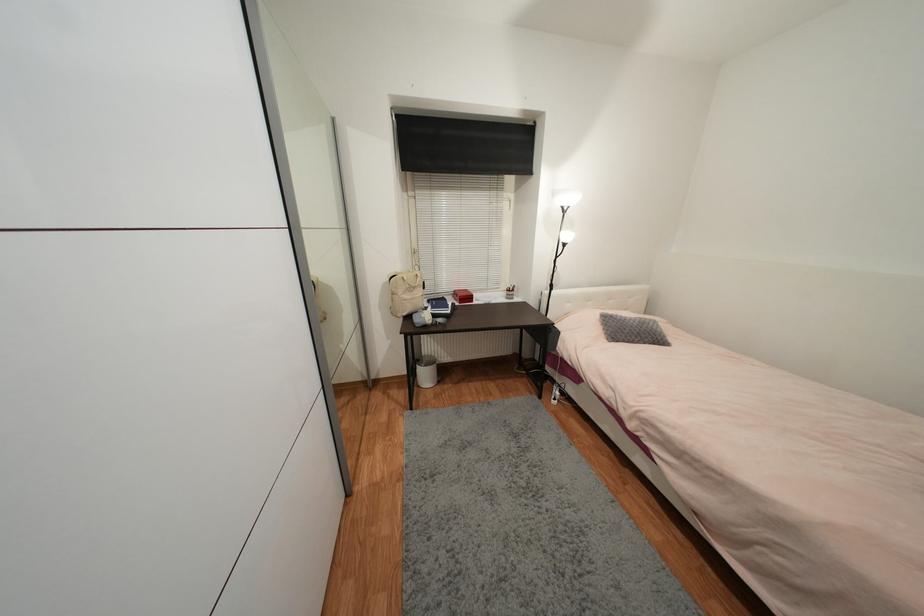
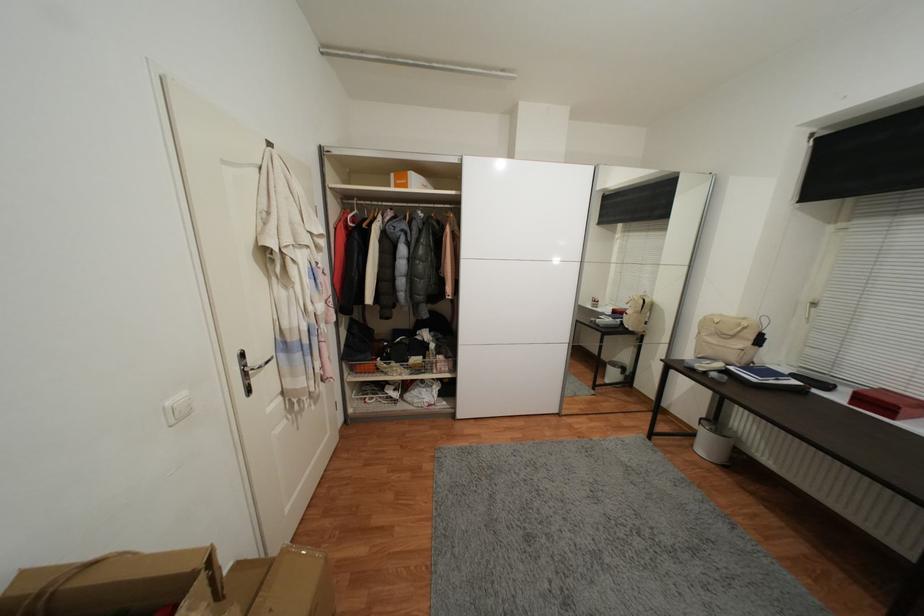
The point at (412, 273) is marked in the first image. Where is the corresponding point in the second image?

(748, 321)